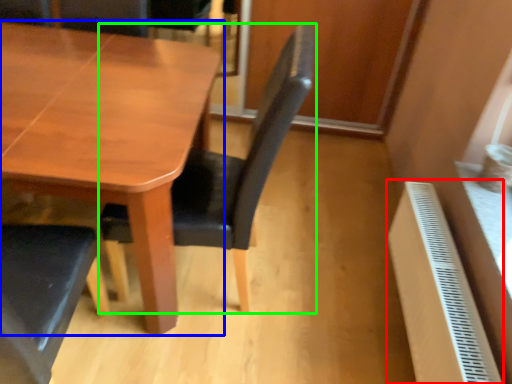
Question: Which is nearer to the radiator (highlighted by a red box)? table (highlighted by a blue box) or chair (highlighted by a green box).

Choices:
 (A) table
 (B) chair

Answer: (B)